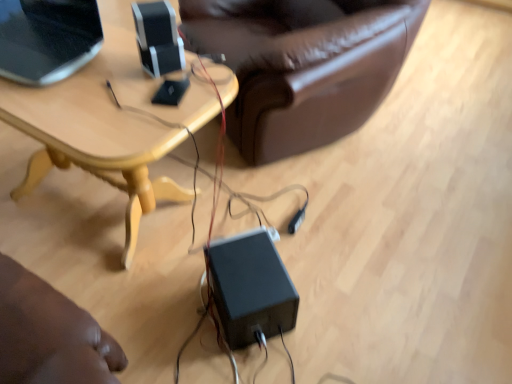
Describe the element at coordinates (158, 38) in the screenshot. This screenshot has height=384, width=512. I see `black matte speaker at upper center, which ranks as the 2th speaker in right-to-left order` at that location.

Measure the distance between point (187, 96) and camera.

A distance of 1.22 meters exists between point (187, 96) and camera.

Find the location of `black matte speaker at upper center, placed as the 1th speaker when sorted from left to right`. black matte speaker at upper center, placed as the 1th speaker when sorted from left to right is located at coordinates (158, 38).

Is light wood table at center at the back of black plastic power supply at center, which is the first speaker from bottom to top?

No, black plastic power supply at center, which is the first speaker from bottom to top, is not facing the opposite direction of light wood table at center.

Find the location of `speaker below the light wood table at center (from a real-world perspective)`. speaker below the light wood table at center (from a real-world perspective) is located at coordinates (251, 288).

Is point (276, 321) closer or farther from the camera than point (154, 193)?

Point (276, 321).

From the image's perspective, who appears lower, black plastic power supply at center, the first speaker from the right, or light wood table at center?

black plastic power supply at center, the first speaker from the right, is shown below in the image.

In order to click on table located below the black matte speaker at upper center, which ranks as the 2th speaker in right-to-left order (from the image's perspective) in this screenshot , I will do `click(106, 127)`.

From a real-world perspective, is black matte speaker at upper center, placed as the 1th speaker when sorted from left to right, over light wood table at center?

Yes, from a real-world perspective, black matte speaker at upper center, placed as the 1th speaker when sorted from left to right, is above light wood table at center.

From the image's perspective, would you say black matte speaker at upper center, marked as the 1th speaker in a top-to-bottom arrangement, is positioned over light wood table at center?

Yes, from the image's perspective, black matte speaker at upper center, marked as the 1th speaker in a top-to-bottom arrangement, is above light wood table at center.

Does black matte speaker at upper center, marked as the 1th speaker in a top-to-bottom arrangement, come behind light wood table at center?

Yes, the depth of black matte speaker at upper center, marked as the 1th speaker in a top-to-bottom arrangement, is greater than that of light wood table at center.

Is matte black laptop at upper left next to light wood table at center?

matte black laptop at upper left is not next to light wood table at center, and they're not touching.

Is matte black laptop at upper left oriented away from light wood table at center?

matte black laptop at upper left is not turned away from light wood table at center.

How many degrees apart are the facing directions of matte black laptop at upper left and light wood table at center?

There is a 0.692-degree angle between the facing directions of matte black laptop at upper left and light wood table at center.

From a real-world perspective, is matte black laptop at upper left positioned over light wood table at center based on gravity?

Indeed, from a real-world perspective, matte black laptop at upper left stands above light wood table at center.

Considering the sizes of objects black plastic power supply at center, which is the first speaker from bottom to top, and matte black laptop at upper left in the image provided, who is shorter, black plastic power supply at center, which is the first speaker from bottom to top, or matte black laptop at upper left?

Standing shorter between the two is black plastic power supply at center, which is the first speaker from bottom to top.

Is black plastic power supply at center, the first speaker from the right, positioned far away from matte black laptop at upper left?

No, there isn't a large distance between black plastic power supply at center, the first speaker from the right, and matte black laptop at upper left.

Between black plastic power supply at center, which is the first speaker from bottom to top, and matte black laptop at upper left, which one has smaller width?

Thinner between the two is black plastic power supply at center, which is the first speaker from bottom to top.

Which object is closer to the camera, light wood table at center or black plastic power supply at center, which is the first speaker from bottom to top?

Positioned in front is light wood table at center.

From the image's perspective, is light wood table at center located above black plastic power supply at center, which is the first speaker from bottom to top?

Result: Correct, light wood table at center appears higher than black plastic power supply at center, which is the first speaker from bottom to top, in the image.

Which point is more forward, (x=85, y=76) or (x=260, y=320)?

The point (x=260, y=320) is more forward.

Is black plastic power supply at center, the first speaker from the right, located within light wood table at center?

Actually, black plastic power supply at center, the first speaker from the right, is outside light wood table at center.

Is black plastic power supply at center, which is the first speaker from bottom to top, turned away from black matte speaker at upper center, placed as the 1th speaker when sorted from left to right?

No, black plastic power supply at center, which is the first speaker from bottom to top, is not facing the opposite direction of black matte speaker at upper center, placed as the 1th speaker when sorted from left to right.

How many degrees apart are the facing directions of black plastic power supply at center, the first speaker from the right, and black matte speaker at upper center, which ranks as the 2th speaker in right-to-left order?

3.71 degrees.

Can you confirm if black plastic power supply at center, the first speaker from the right, is smaller than black matte speaker at upper center, which ranks as the 2th speaker in right-to-left order?

No, black plastic power supply at center, the first speaker from the right, is not smaller than black matte speaker at upper center, which ranks as the 2th speaker in right-to-left order.

Is light wood table at center not inside matte black laptop at upper left?

light wood table at center is positioned outside matte black laptop at upper left.

Is light wood table at center directly adjacent to matte black laptop at upper left?

No, light wood table at center is not in contact with matte black laptop at upper left.

Which object is thinner, light wood table at center or matte black laptop at upper left?

Thinner between the two is matte black laptop at upper left.

From a real-world perspective, is light wood table at center positioned above or below matte black laptop at upper left?

In terms of real-world spatial position, light wood table at center is below matte black laptop at upper left.

At what (x,y) coordinates should I click in order to perform the action: click on table above the black plastic power supply at center, which ranks as the 2th speaker in top-to-bottom order (from a real-world perspective). Please return your answer as a coordinate pair (x, y). This screenshot has height=384, width=512. Looking at the image, I should click on [x=106, y=127].

This screenshot has height=384, width=512. I want to click on speaker above the light wood table at center (from the image's perspective), so click(158, 38).

Based on their spatial positions, is black plastic power supply at center, the second speaker viewed from the left, or black matte speaker at upper center, placed as the 1th speaker when sorted from left to right, closer to matte black laptop at upper left?

Based on the image, black matte speaker at upper center, placed as the 1th speaker when sorted from left to right, appears to be nearer to matte black laptop at upper left.

Looking at the image, which one is located further to matte black laptop at upper left, black matte speaker at upper center, placed as the 1th speaker when sorted from left to right, or black plastic power supply at center, which is the first speaker from bottom to top?

The object further to matte black laptop at upper left is black plastic power supply at center, which is the first speaker from bottom to top.

Considering their positions, is matte black laptop at upper left positioned further to black matte speaker at upper center, which ranks as the 2th speaker in right-to-left order, than light wood table at center?

The object further to black matte speaker at upper center, which ranks as the 2th speaker in right-to-left order, is matte black laptop at upper left.

Considering their positions, is black plastic power supply at center, which ranks as the 2th speaker in top-to-bottom order, positioned closer to light wood table at center than matte black laptop at upper left?

matte black laptop at upper left lies closer to light wood table at center than the other object.

Looking at the image, which one is located closer to matte black laptop at upper left, black matte speaker at upper center, marked as the 1th speaker in a top-to-bottom arrangement, or light wood table at center?

light wood table at center.

Based on their spatial positions, is black matte speaker at upper center, placed as the 1th speaker when sorted from left to right, or matte black laptop at upper left closer to light wood table at center?

matte black laptop at upper left is positioned closer to the anchor light wood table at center.

Looking at the image, which one is located closer to black plastic power supply at center, which is the first speaker from bottom to top, black matte speaker at upper center, placed as the 1th speaker when sorted from left to right, or light wood table at center?

light wood table at center lies closer to black plastic power supply at center, which is the first speaker from bottom to top, than the other object.

Which object lies further to the anchor point matte black laptop at upper left, black plastic power supply at center, which ranks as the 2th speaker in top-to-bottom order, or light wood table at center?

black plastic power supply at center, which ranks as the 2th speaker in top-to-bottom order, is further to matte black laptop at upper left.

The height and width of the screenshot is (384, 512). Find the location of `table between matte black laptop at upper left and black matte speaker at upper center, placed as the 1th speaker when sorted from left to right, in the horizontal direction`. table between matte black laptop at upper left and black matte speaker at upper center, placed as the 1th speaker when sorted from left to right, in the horizontal direction is located at coordinates coord(106,127).

Locate an element on the screen. The height and width of the screenshot is (384, 512). table that lies between matte black laptop at upper left and black plastic power supply at center, which ranks as the 2th speaker in top-to-bottom order, from top to bottom is located at coordinates (106, 127).

Locate an element on the screen. Image resolution: width=512 pixels, height=384 pixels. speaker between matte black laptop at upper left and black plastic power supply at center, which is the first speaker from bottom to top, in the up-down direction is located at coordinates (158, 38).

Where is `table between black matte speaker at upper center, placed as the 1th speaker when sorted from left to right, and black plastic power supply at center, which ranks as the 2th speaker in top-to-bottom order, vertically`? table between black matte speaker at upper center, placed as the 1th speaker when sorted from left to right, and black plastic power supply at center, which ranks as the 2th speaker in top-to-bottom order, vertically is located at coordinates (106, 127).